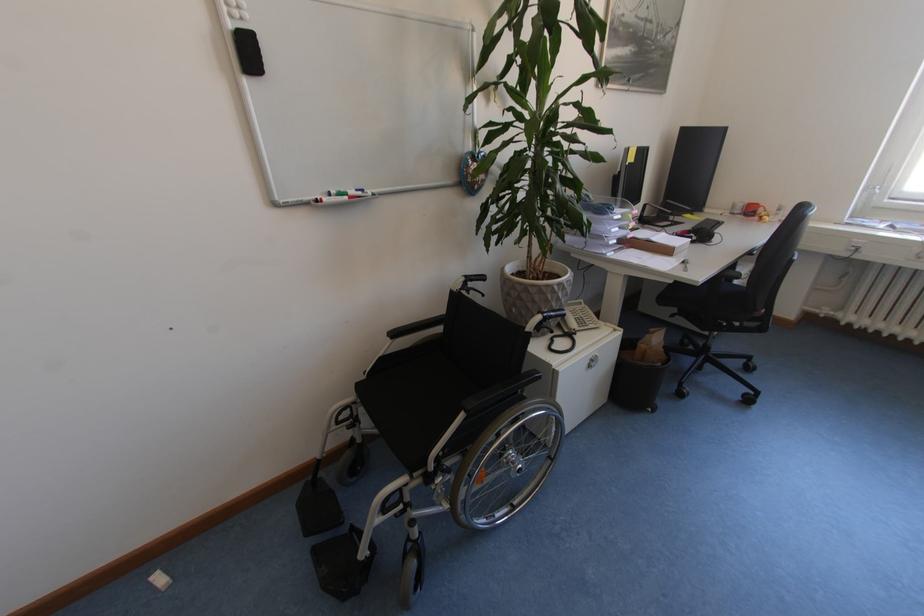
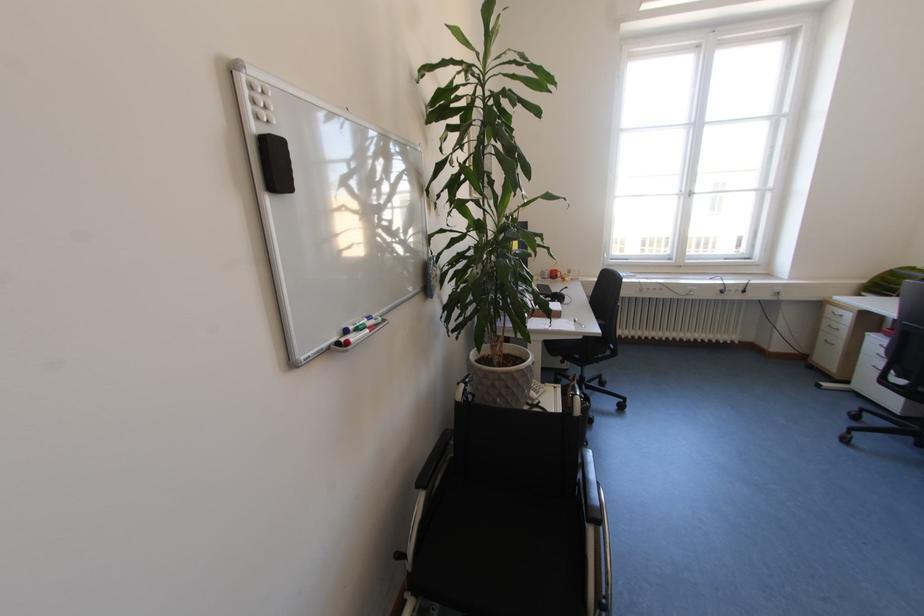
The point at (678, 283) is marked in the first image. Where is the corresponding point in the second image?

(589, 339)